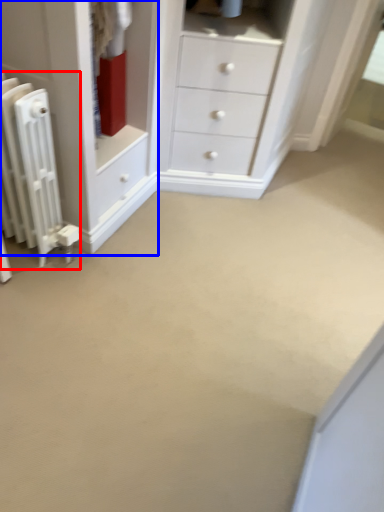
Question: Which object appears closest to the camera in this image, radiator (highlighted by a red box) or chest of drawers (highlighted by a blue box)?

Choices:
 (A) radiator
 (B) chest of drawers

Answer: (A)